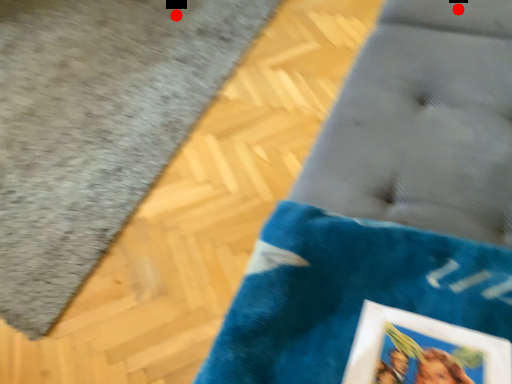
Question: Two points are circled on the image, labeled by A and B beside each circle. Which point is closer to the camera?

Choices:
 (A) A is closer
 (B) B is closer

Answer: (A)